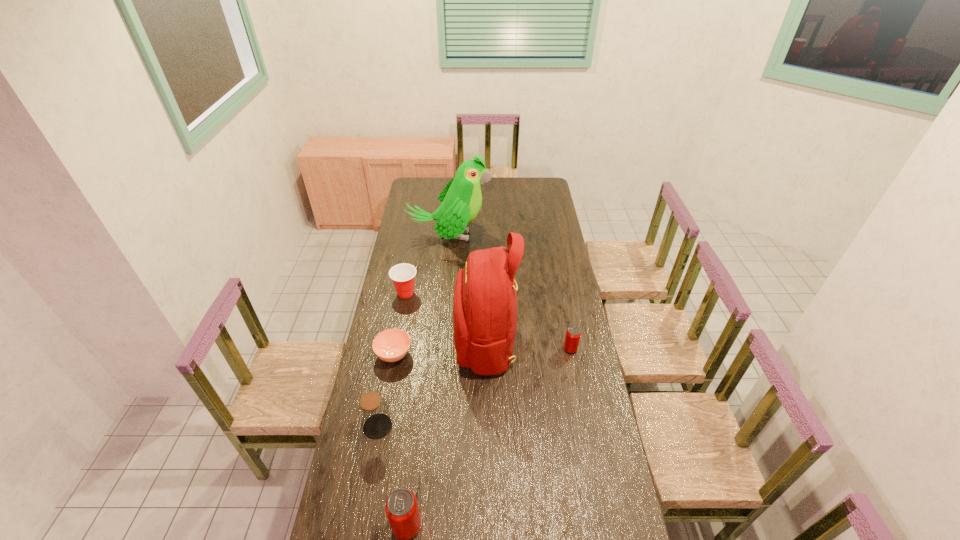
Where is `free region that satisfies the following two spatial constraints: 1. on the back side of the shortest object; 2. on the left side of the second nearest object`? The width and height of the screenshot is (960, 540). free region that satisfies the following two spatial constraints: 1. on the back side of the shortest object; 2. on the left side of the second nearest object is located at coordinates (391, 355).

The width and height of the screenshot is (960, 540). Find the location of `vacant space that satisfies the following two spatial constraints: 1. on the beak of the farthest object; 2. on the left side of the rightmost object`. vacant space that satisfies the following two spatial constraints: 1. on the beak of the farthest object; 2. on the left side of the rightmost object is located at coordinates (440, 349).

The image size is (960, 540). Identify the location of vacant area in the image that satisfies the following two spatial constraints: 1. on the back side of the second nearest object; 2. on the left side of the second farthest object. pyautogui.click(x=402, y=293).